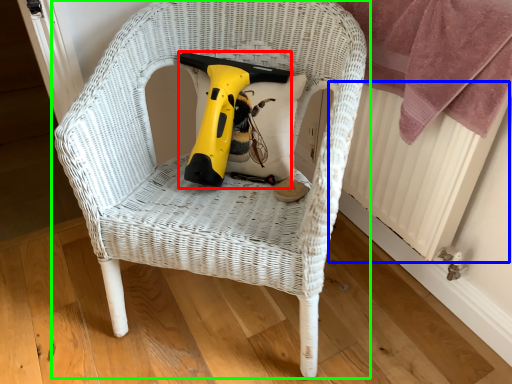
Question: Based on their relative distances, which object is farther from electric drill (highlighted by a red box)? Choose from radiator (highlighted by a blue box) and chair (highlighted by a green box).

Choices:
 (A) radiator
 (B) chair

Answer: (A)